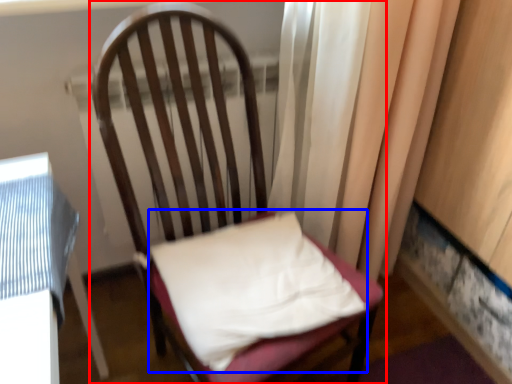
Question: Which object appears farthest to the camera in this image, chair (highlighted by a red box) or pillow (highlighted by a blue box)?

Choices:
 (A) chair
 (B) pillow

Answer: (B)